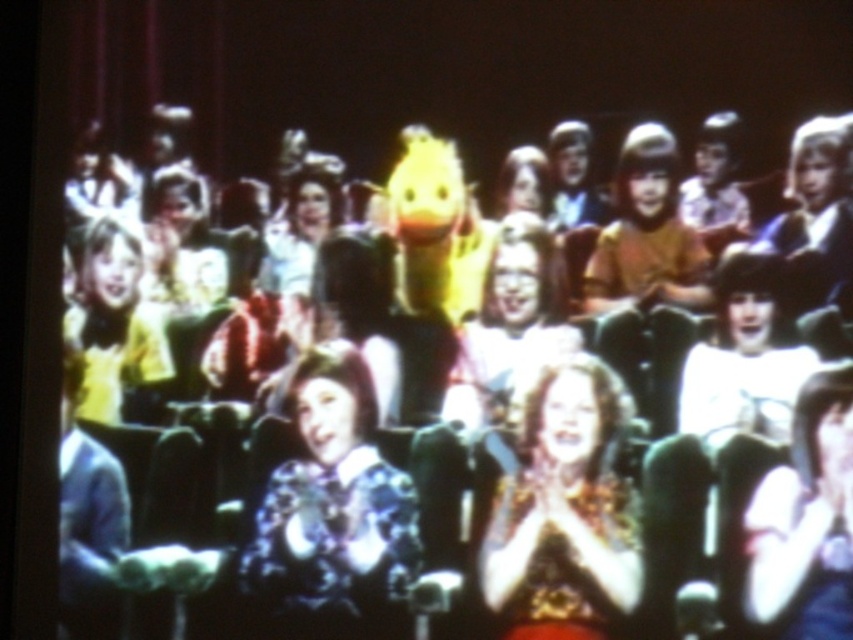
You are a photographer trying to capture a clear photo of the curly hair at center and the matte black dress at center. Which object would be in the foreground of your photo?

The curly hair at center would be in the foreground because the matte black dress at center is behind it.

In the auditorium scene, there are children dressed in colorful outfits and a large yellow puppet. A point at coordinates [332,515] is marked. Which object from the list corresponds to this point? List the object exactly as provided.

The point at coordinates [332,515] corresponds to the floral patterned blouse at center.